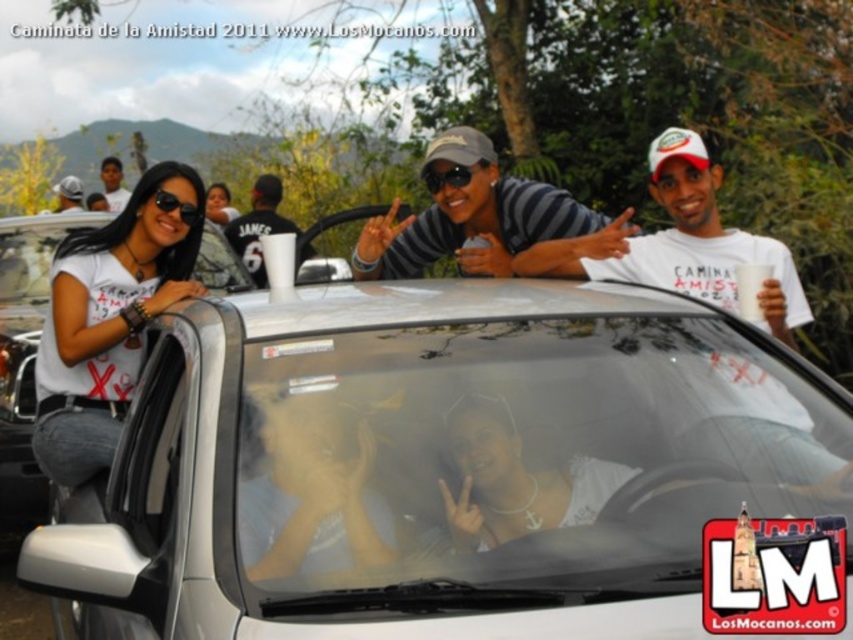
What are the coordinates of the silver metallic car at center in the image?

The silver metallic car at center is located at coordinates (463, 472).

In the scene shown: You are a photographer at the event and want to capture a photo of the black jersey at center and the matte black sunglasses at upper left. Which object should you focus on first if you want to include both in the frame without moving the camera?

You should focus on the matte black sunglasses at upper left first because the black jersey at center is to the right of it, so starting from the left allows you to include both in the frame without moving the camera.